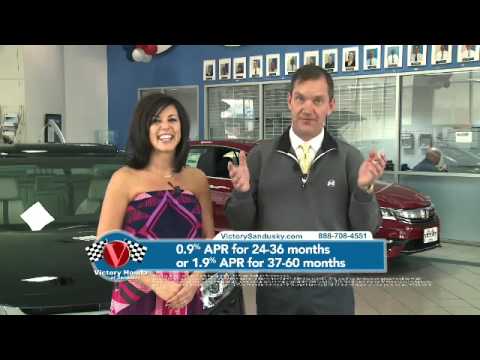
You are a GUI agent. You are given a task and a screenshot of the screen. Output one action in this format:
    pyautogui.click(x=<x>, y=<y>)
    Task: Click on the floor
    The image size is (480, 360).
    Given the screenshot: What is the action you would take?
    pyautogui.click(x=437, y=284)